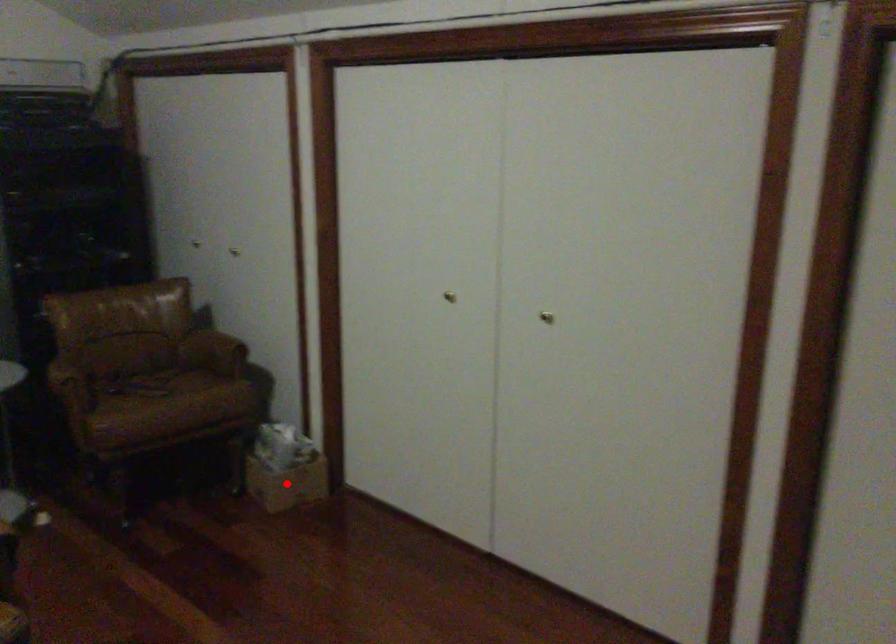
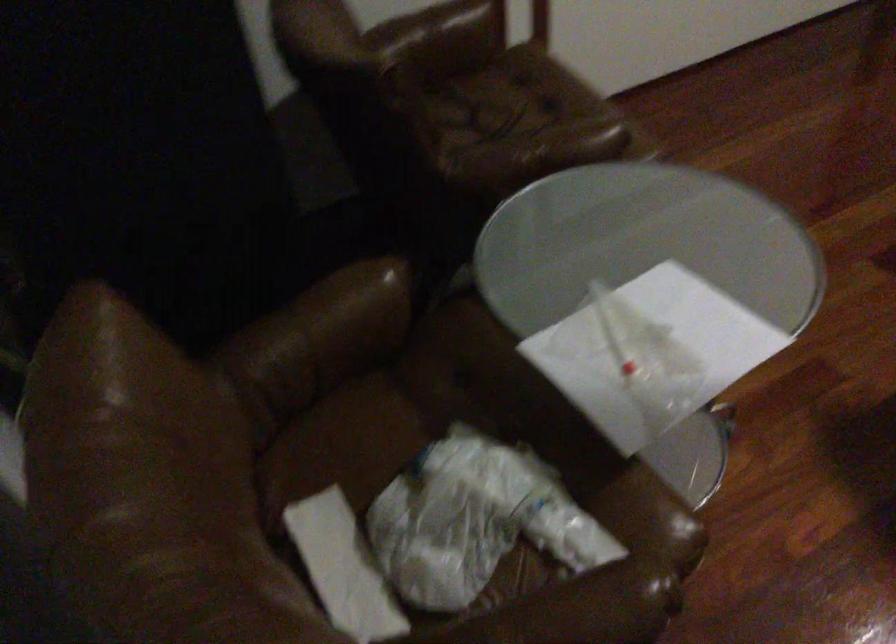
Question: I am providing you with two images of the same scene from different viewpoints. A red point is marked on the first image. At the location where the point appears in image 1, is it still visible in image 2?

Choices:
 (A) Yes
 (B) No

Answer: (B)